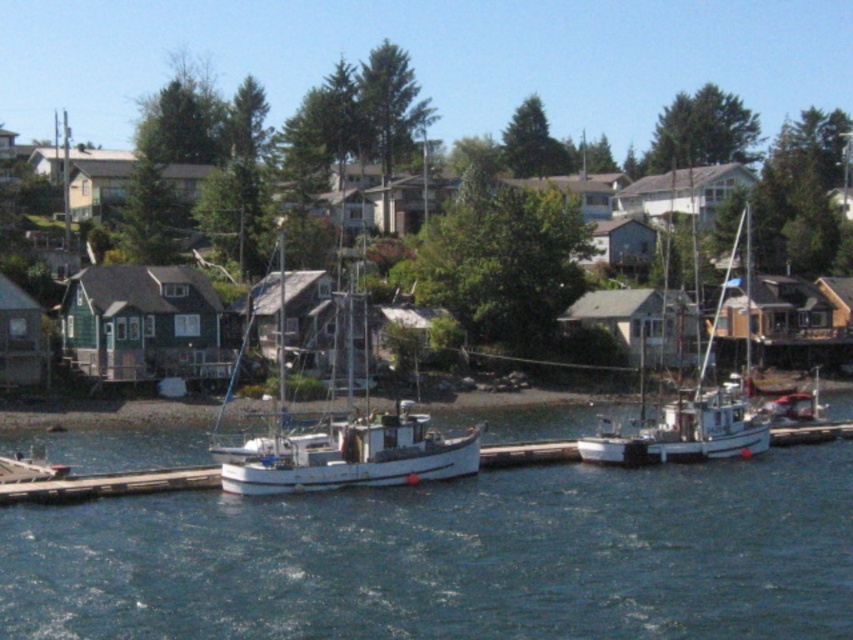
Question: Where is white matte boat at center located in relation to white matte sailboat at center in the image?

Choices:
 (A) below
 (B) above

Answer: (A)

Question: From the image, what is the correct spatial relationship of blue water at center in relation to white matte boat at center?

Choices:
 (A) below
 (B) above

Answer: (A)

Question: Which object is the farthest from the blue water at center?

Choices:
 (A) white matte boat at center
 (B) white matte sailboat at center

Answer: (B)

Question: Is blue water at center below white matte sailboat at center?

Choices:
 (A) yes
 (B) no

Answer: (A)

Question: Among these objects, which one is farthest from the camera?

Choices:
 (A) white matte boat at center
 (B) white matte sailboat at center
 (C) blue water at center

Answer: (B)

Question: Among these points, which one is farthest from the camera?

Choices:
 (A) (457, 452)
 (B) (682, 422)

Answer: (B)